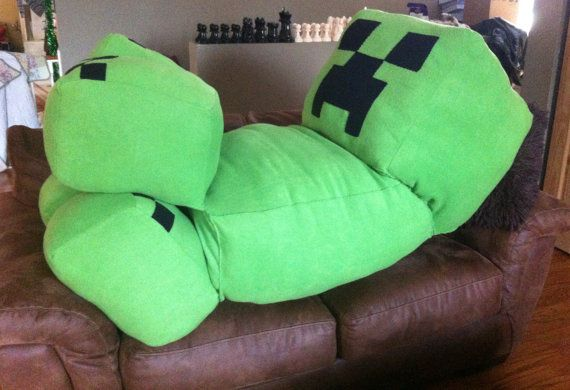
I want to click on chess set, so click(x=288, y=36).